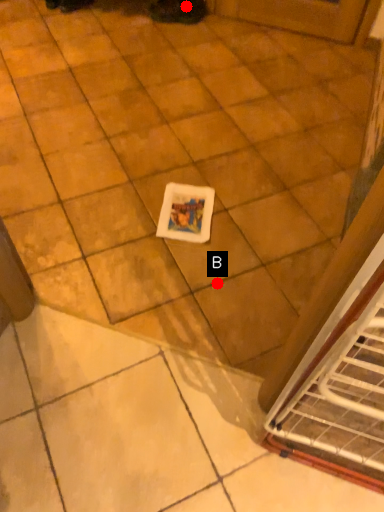
Question: Two points are circled on the image, labeled by A and B beside each circle. Which point appears farthest from the camera in this image?

Choices:
 (A) A is further
 (B) B is further

Answer: (A)